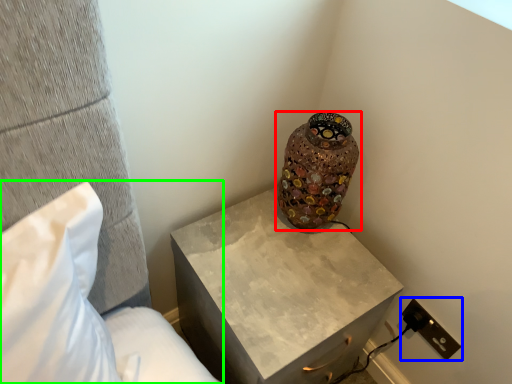
Question: Which is nearer to the vase (highlighted by a red box)? electric outlet (highlighted by a blue box) or furniture (highlighted by a green box).

Choices:
 (A) electric outlet
 (B) furniture

Answer: (A)